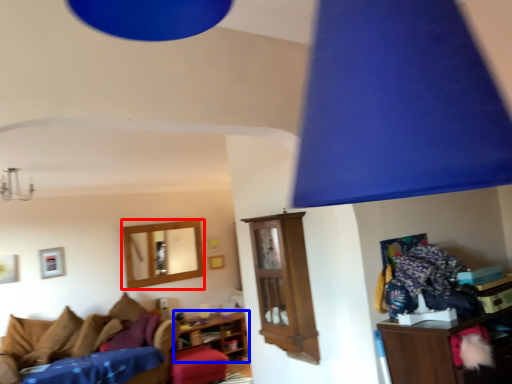
Question: Which point is further to the camera, picture frame (highlighted by a red box) or shelf (highlighted by a blue box)?

Choices:
 (A) picture frame
 (B) shelf

Answer: (A)